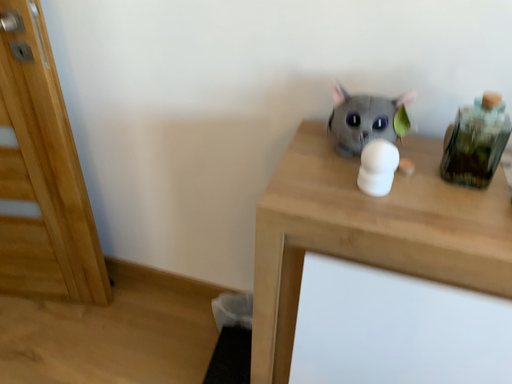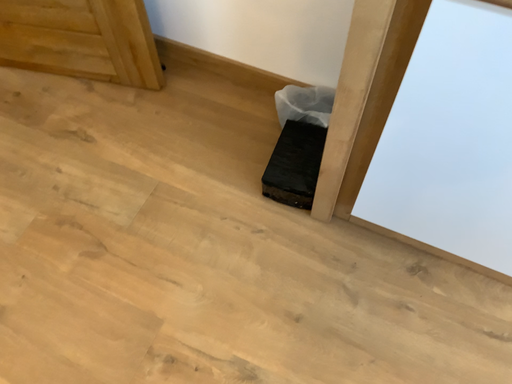
Question: Which way did the camera rotate in the video?

Choices:
 (A) rotated right
 (B) rotated left

Answer: (B)